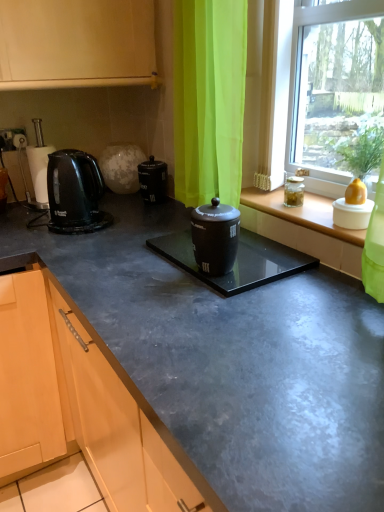
What are the coordinates of `vacant area that is situated to the right of black glossy electric kettle at left` in the screenshot? It's located at (136, 220).